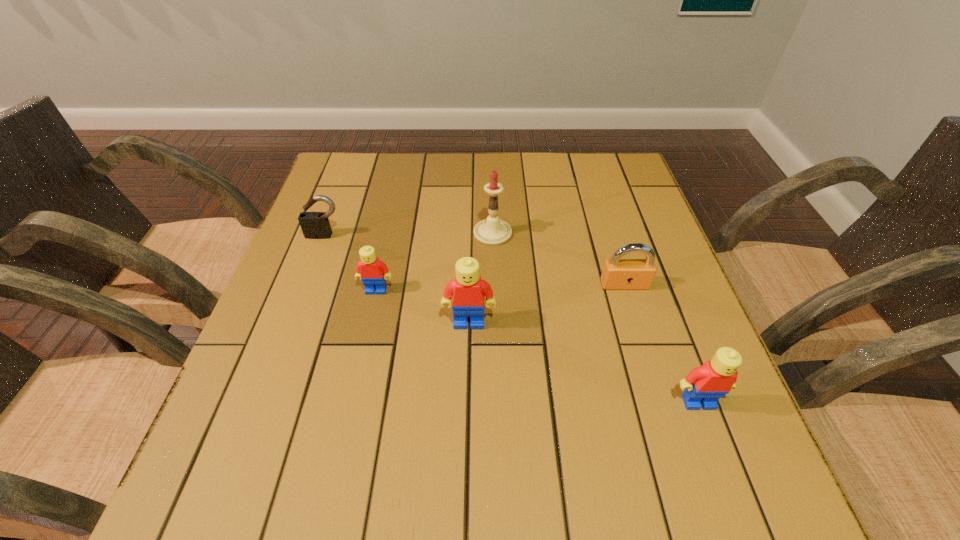
The height and width of the screenshot is (540, 960). What are the coordinates of `vacant area located 0.180m on the face of the second object from left to right` in the screenshot? It's located at (359, 367).

The width and height of the screenshot is (960, 540). What are the coordinates of `vacant space located 0.220m on the face of the second Lego from left to right` in the screenshot? It's located at (467, 436).

Where is `vacant space located 0.050m on the face of the nearest object`? This screenshot has width=960, height=540. vacant space located 0.050m on the face of the nearest object is located at coordinates (712, 440).

At what (x,y) coordinates should I click in order to perform the action: click on vacant space located 0.340m to unlock the nearer padlock from the front. Please return your answer as a coordinate pair (x, y). The image size is (960, 540). Looking at the image, I should click on (673, 441).

Locate an element on the screen. Image resolution: width=960 pixels, height=540 pixels. vacant space located on the right of the candle is located at coordinates (536, 233).

The width and height of the screenshot is (960, 540). Identify the location of free space located with the keyhole on the front of the left padlock. (296, 315).

Where is `object that is at the near edge`? This screenshot has height=540, width=960. object that is at the near edge is located at coordinates click(x=704, y=385).

Where is `object at the left edge`? The image size is (960, 540). object at the left edge is located at coordinates (315, 225).

What are the coordinates of `Lego present at the right edge` in the screenshot? It's located at (704, 385).

You are a GUI agent. You are given a task and a screenshot of the screen. Output one action in this format:
    pyautogui.click(x=<x>, y=<y>)
    Task: Click on the padlock located at the right edge
    Image resolution: width=960 pixels, height=540 pixels.
    Given the screenshot: What is the action you would take?
    pyautogui.click(x=617, y=273)